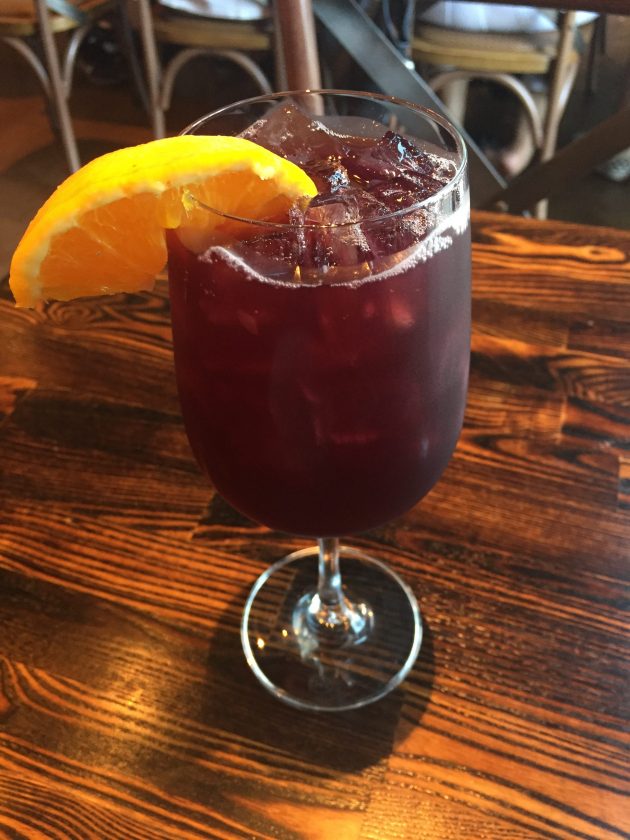
Locate an element on the screen. The width and height of the screenshot is (630, 840). floor is located at coordinates (21, 137).